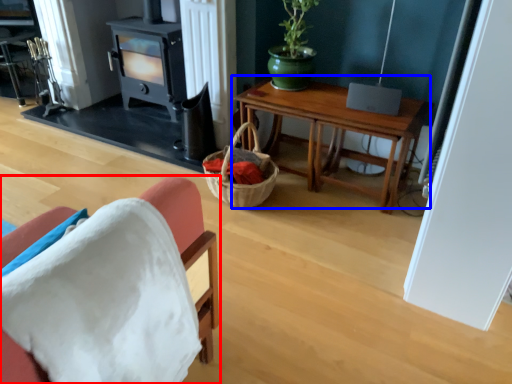
Question: Which point is further to the camera, chair (highlighted by a red box) or table (highlighted by a blue box)?

Choices:
 (A) chair
 (B) table

Answer: (B)